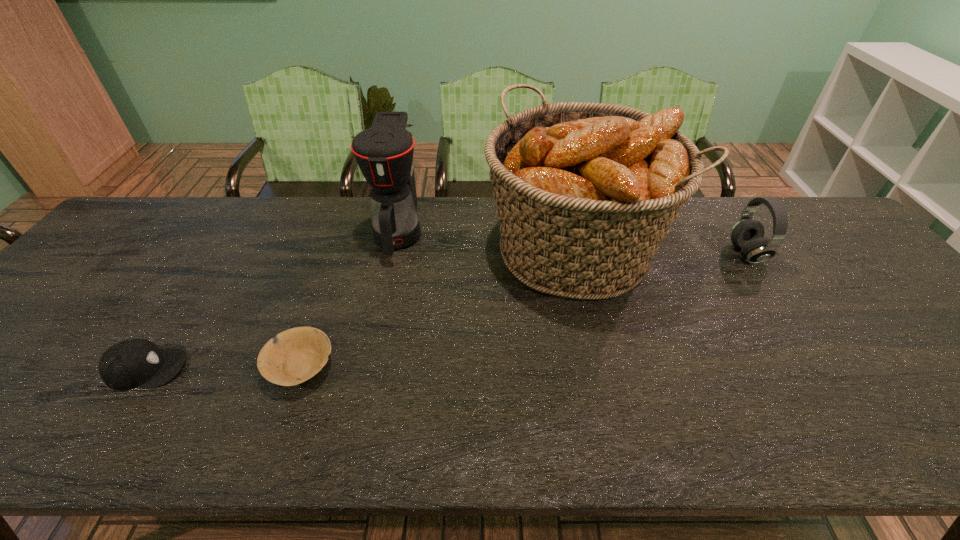
Where is `basket`? basket is located at coordinates (585, 192).

Identify the location of the tallest object. pyautogui.click(x=585, y=192).

This screenshot has width=960, height=540. I want to click on coffee maker, so click(x=384, y=152).

Locate an element on the screen. The height and width of the screenshot is (540, 960). headset is located at coordinates (747, 235).

Identify the location of the rightmost object. (747, 235).

The width and height of the screenshot is (960, 540). I want to click on the fourth tallest object, so click(135, 363).

Image resolution: width=960 pixels, height=540 pixels. I want to click on the leftmost object, so click(135, 363).

At what (x,y) coordinates should I click in order to perform the action: click on bowl. Please return your answer as a coordinate pair (x, y). This screenshot has width=960, height=540. Looking at the image, I should click on point(293,356).

What are the coordinates of `vacant region located on the left of the basket` in the screenshot? It's located at (467, 251).

Where is `vacant area located pour from the carafe of the second tallest object`? vacant area located pour from the carafe of the second tallest object is located at coordinates (383, 301).